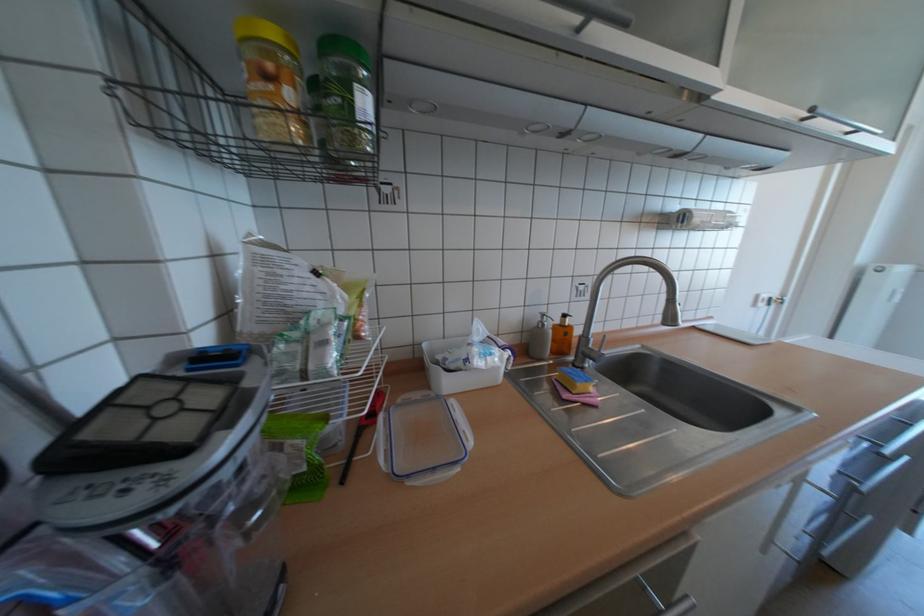
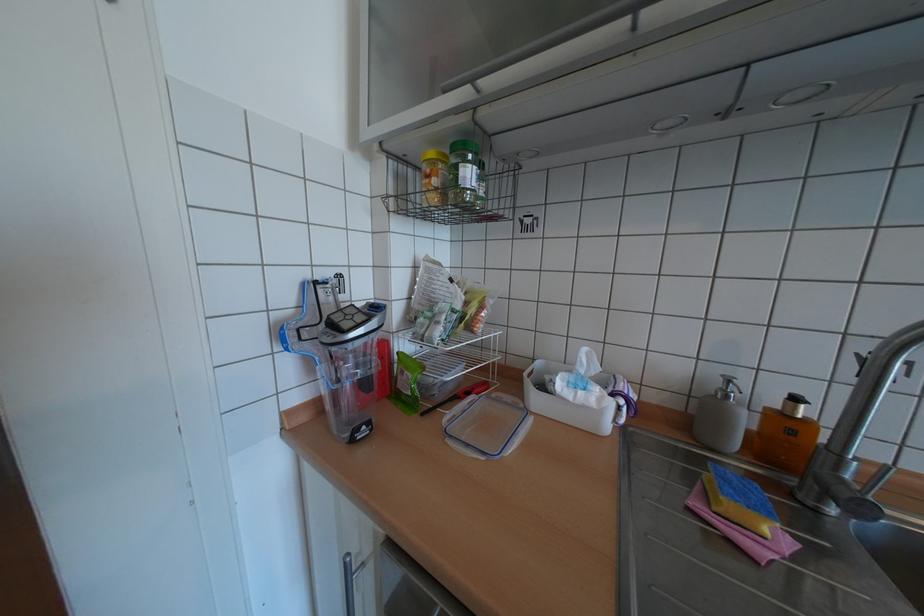
In the second image, find the point that corresponds to (373,111) in the first image.

(473, 177)